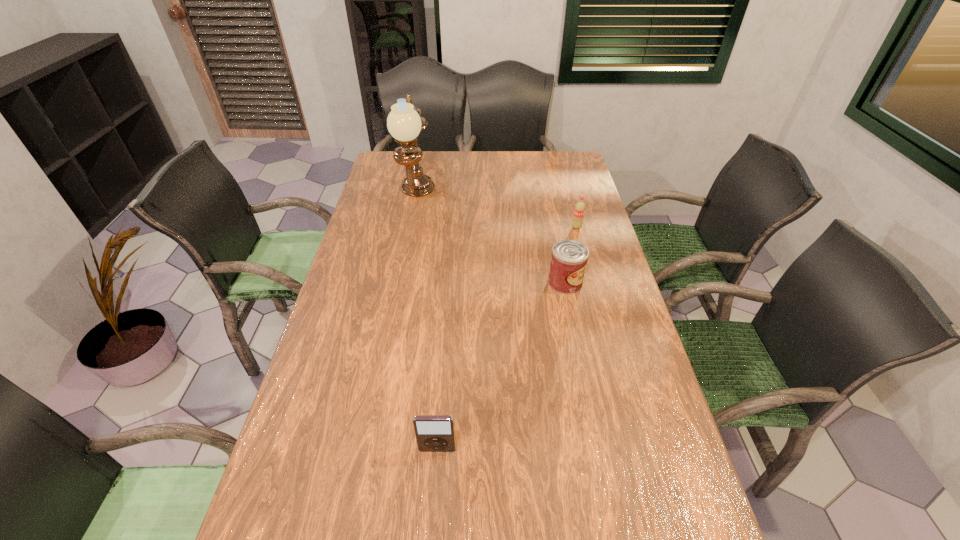
This screenshot has width=960, height=540. What are the coordinates of `vacant area situated 0.160m on the back of the third object from left to right` in the screenshot? It's located at (557, 240).

Image resolution: width=960 pixels, height=540 pixels. What are the coordinates of `free space located 0.260m on the front of the second farthest object` in the screenshot? It's located at (590, 281).

This screenshot has width=960, height=540. I want to click on object that is at the left edge, so tap(404, 122).

I want to click on can located at the right edge, so click(569, 257).

Identify the location of soda that is at the right edge. (579, 210).

Identify the location of free location at the left edge. (355, 241).

Find the location of `free space at the right edge`. free space at the right edge is located at coordinates (603, 286).

The image size is (960, 540). Find the location of `vacant space at the far right corner of the desktop`. vacant space at the far right corner of the desktop is located at coordinates (568, 165).

Identify the location of vacant point located between the leftmost object and the iPod. (427, 323).

What are the coordinates of `empty space that is in between the second object from right to left and the oil lamp` in the screenshot? It's located at (491, 240).